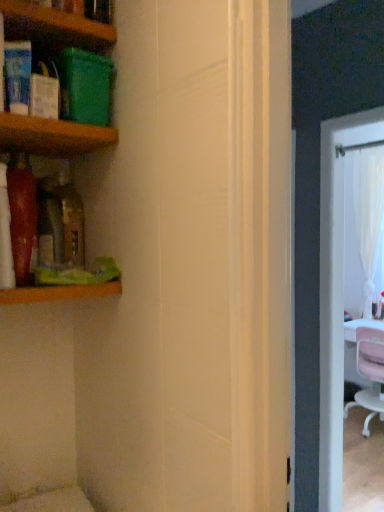
In order to face wooden shelf at upper left, the 2th shelf viewed from the top, should I rotate leftwards or rightwards?

It's best to rotate left around 25.055 degrees.

Locate an element on the screen. wooden shelf at left, the 1th shelf in the bottom-to-top sequence is located at coordinates (58, 293).

This screenshot has width=384, height=512. Describe the element at coordinates (58, 20) in the screenshot. I see `wooden shelf at upper left, the 1th shelf positioned from the top` at that location.

You are a GUI agent. You are given a task and a screenshot of the screen. Output one action in this format:
    pyautogui.click(x=<x>, y=<y>)
    Task: Click on the pink fabric chair at right
    
    Given the screenshot: What is the action you would take?
    pyautogui.click(x=369, y=373)

Locate an element on the screen. The height and width of the screenshot is (512, 384). wooden shelf at upper left, arranged as the 2th shelf when ordered from the bottom is located at coordinates [x=52, y=136].

From the image's perspective, which object appears higher, wooden shelf at upper left, the 2th shelf viewed from the top, or wooden shelf at left, the third shelf from the top?

wooden shelf at upper left, the 2th shelf viewed from the top, appears higher in the image.

Does point (22, 141) appear closer or farther from the camera than point (7, 294)?

Point (22, 141) appears to be farther away from the viewer than point (7, 294).

Where is `the 1st shelf positioned above the wooden shelf at left, the third shelf from the top (from a real-world perspective)`? the 1st shelf positioned above the wooden shelf at left, the third shelf from the top (from a real-world perspective) is located at coordinates (52, 136).

In the image, is wooden shelf at upper left, arranged as the 2th shelf when ordered from the bottom, positioned in front of or behind wooden shelf at left, the third shelf from the top?

Visually, wooden shelf at upper left, arranged as the 2th shelf when ordered from the bottom, is located in front of wooden shelf at left, the third shelf from the top.

From a real-world perspective, is wooden shelf at left, the third shelf from the top, on top of wooden shelf at upper left, the 1th shelf positioned from the top?

No, from a real-world perspective, wooden shelf at left, the third shelf from the top, is not above wooden shelf at upper left, the 1th shelf positioned from the top.

How much distance is there between wooden shelf at left, the third shelf from the top, and wooden shelf at upper left, which appears as the third shelf when ordered from the bottom?

wooden shelf at left, the third shelf from the top, and wooden shelf at upper left, which appears as the third shelf when ordered from the bottom, are 22.03 inches apart.

Which is more to the left, wooden shelf at left, the third shelf from the top, or wooden shelf at upper left, the 1th shelf positioned from the top?

Positioned to the left is wooden shelf at upper left, the 1th shelf positioned from the top.

Could you tell me if wooden shelf at left, the 1th shelf in the bottom-to-top sequence, is turned towards wooden shelf at upper left, which appears as the third shelf when ordered from the bottom?

No, wooden shelf at left, the 1th shelf in the bottom-to-top sequence, is not facing towards wooden shelf at upper left, which appears as the third shelf when ordered from the bottom.

Are wooden shelf at upper left, which appears as the third shelf when ordered from the bottom, and wooden shelf at upper left, the 2th shelf viewed from the top, located far from each other?

They are positioned close to each other.

From the image's perspective, between wooden shelf at upper left, the 1th shelf positioned from the top, and wooden shelf at upper left, arranged as the 2th shelf when ordered from the bottom, who is located below?

wooden shelf at upper left, arranged as the 2th shelf when ordered from the bottom.

Who is smaller, wooden shelf at upper left, the 1th shelf positioned from the top, or wooden shelf at upper left, arranged as the 2th shelf when ordered from the bottom?

Smaller between the two is wooden shelf at upper left, arranged as the 2th shelf when ordered from the bottom.

Do you think wooden shelf at upper left, which appears as the third shelf when ordered from the bottom, is within wooden shelf at upper left, the 2th shelf viewed from the top, or outside of it?

The correct answer is: outside.

From the image's perspective, is pink fabric chair at right positioned above or below wooden shelf at left, the third shelf from the top?

From the image's perspective, pink fabric chair at right appears below wooden shelf at left, the third shelf from the top.

Between point (378, 367) and point (1, 296), which one is positioned behind?

The point (378, 367) is more distant.

Is pink fabric chair at right in contact with wooden shelf at left, the third shelf from the top?

They are not placed beside each other.

Can you confirm if wooden shelf at upper left, which appears as the third shelf when ordered from the bottom, is thinner than wooden shelf at left, the third shelf from the top?

No.

Who is shorter, wooden shelf at upper left, the 1th shelf positioned from the top, or wooden shelf at left, the 1th shelf in the bottom-to-top sequence?

wooden shelf at left, the 1th shelf in the bottom-to-top sequence.

Measure the distance between wooden shelf at upper left, which appears as the third shelf when ordered from the bottom, and wooden shelf at left, the third shelf from the top.

22.03 inches.

Is wooden shelf at upper left, the 1th shelf positioned from the top, facing away from wooden shelf at left, the third shelf from the top?

wooden shelf at upper left, the 1th shelf positioned from the top, does not have its back to wooden shelf at left, the third shelf from the top.

Does wooden shelf at left, the third shelf from the top, have a lesser height compared to wooden shelf at upper left, arranged as the 2th shelf when ordered from the bottom?

Incorrect, the height of wooden shelf at left, the third shelf from the top, does not fall short of that of wooden shelf at upper left, arranged as the 2th shelf when ordered from the bottom.

Could you tell me if wooden shelf at left, the third shelf from the top, is turned towards wooden shelf at upper left, arranged as the 2th shelf when ordered from the bottom?

No, wooden shelf at left, the third shelf from the top, is not facing towards wooden shelf at upper left, arranged as the 2th shelf when ordered from the bottom.

Which point is more distant from viewer, (54, 289) or (13, 147)?

Positioned behind is point (13, 147).

From the picture: Which object is positioned more to the left, wooden shelf at upper left, arranged as the 2th shelf when ordered from the bottom, or wooden shelf at upper left, the 1th shelf positioned from the top?

Positioned to the left is wooden shelf at upper left, the 1th shelf positioned from the top.

From a real-world perspective, which object rests below the other?

wooden shelf at upper left, arranged as the 2th shelf when ordered from the bottom.

Is the position of wooden shelf at upper left, arranged as the 2th shelf when ordered from the bottom, more distant than that of wooden shelf at upper left, the 1th shelf positioned from the top?

Yes, wooden shelf at upper left, arranged as the 2th shelf when ordered from the bottom, is further from the viewer.

In the scene shown: Considering the sizes of wooden shelf at upper left, the 2th shelf viewed from the top, and wooden shelf at upper left, which appears as the third shelf when ordered from the bottom, in the image, is wooden shelf at upper left, the 2th shelf viewed from the top, taller or shorter than wooden shelf at upper left, which appears as the third shelf when ordered from the bottom,?

wooden shelf at upper left, the 2th shelf viewed from the top, is shorter than wooden shelf at upper left, which appears as the third shelf when ordered from the bottom.

I want to click on shelf that is the 1st one when counting upward from the wooden shelf at left, the 1th shelf in the bottom-to-top sequence (from the image's perspective), so click(52, 136).

The height and width of the screenshot is (512, 384). I want to click on the 2nd shelf in front of the wooden shelf at left, the 1th shelf in the bottom-to-top sequence, so click(58, 20).

Looking at the image, which one is located further to wooden shelf at upper left, arranged as the 2th shelf when ordered from the bottom, wooden shelf at left, the 1th shelf in the bottom-to-top sequence, or pink fabric chair at right?

pink fabric chair at right lies further to wooden shelf at upper left, arranged as the 2th shelf when ordered from the bottom, than the other object.

Looking at the image, which one is located closer to wooden shelf at left, the third shelf from the top, wooden shelf at upper left, the 2th shelf viewed from the top, or wooden shelf at upper left, the 1th shelf positioned from the top?

wooden shelf at upper left, the 2th shelf viewed from the top, lies closer to wooden shelf at left, the third shelf from the top, than the other object.

Looking at the image, which one is located closer to wooden shelf at left, the 1th shelf in the bottom-to-top sequence, wooden shelf at upper left, the 2th shelf viewed from the top, or pink fabric chair at right?

wooden shelf at upper left, the 2th shelf viewed from the top, is closer to wooden shelf at left, the 1th shelf in the bottom-to-top sequence.

From the image, which object appears to be farther from wooden shelf at upper left, the 1th shelf positioned from the top, pink fabric chair at right or wooden shelf at left, the third shelf from the top?

pink fabric chair at right is further to wooden shelf at upper left, the 1th shelf positioned from the top.

Estimate the real-world distances between objects in this image. Which object is closer to pink fabric chair at right, wooden shelf at left, the third shelf from the top, or wooden shelf at upper left, the 2th shelf viewed from the top?

wooden shelf at left, the third shelf from the top.

Which object lies nearer to the anchor point wooden shelf at upper left, the 1th shelf positioned from the top, wooden shelf at upper left, the 2th shelf viewed from the top, or wooden shelf at left, the third shelf from the top?

Among the two, wooden shelf at upper left, the 2th shelf viewed from the top, is located nearer to wooden shelf at upper left, the 1th shelf positioned from the top.

Based on their spatial positions, is wooden shelf at upper left, the 1th shelf positioned from the top, or pink fabric chair at right further from wooden shelf at left, the 1th shelf in the bottom-to-top sequence?

pink fabric chair at right lies further to wooden shelf at left, the 1th shelf in the bottom-to-top sequence, than the other object.

From the image, which object appears to be farther from wooden shelf at left, the 1th shelf in the bottom-to-top sequence, wooden shelf at upper left, which appears as the third shelf when ordered from the bottom, or wooden shelf at upper left, arranged as the 2th shelf when ordered from the bottom?

Based on the image, wooden shelf at upper left, which appears as the third shelf when ordered from the bottom, appears to be further to wooden shelf at left, the 1th shelf in the bottom-to-top sequence.

Identify the location of shelf positioned between wooden shelf at upper left, the 2th shelf viewed from the top, and pink fabric chair at right from near to far. The height and width of the screenshot is (512, 384). (58, 293).

Identify the location of shelf between wooden shelf at upper left, the 1th shelf positioned from the top, and wooden shelf at left, the third shelf from the top, in the up-down direction. (52, 136).